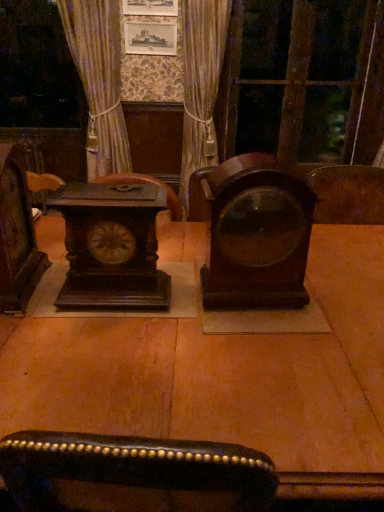
Measure the distance between point (x=83, y=368) and camera.

A: They are 36.22 inches apart.

The image size is (384, 512). Find the location of `dark wood table at center`. dark wood table at center is located at coordinates (220, 371).

I want to click on velvet gold curtain at center, so click(201, 84).

The height and width of the screenshot is (512, 384). In order to click on dark wood table at center in this screenshot , I will do 220,371.

Consider the image. Is mahogany wood alarm clock at center, which is counted as the 1th alarm clock, starting from the right, in front of or behind velvet gold curtain at center in the image?

mahogany wood alarm clock at center, which is counted as the 1th alarm clock, starting from the right, is in front of velvet gold curtain at center.

From a real-world perspective, which object stands above the other?

velvet gold curtain at center, from a real-world perspective.

Is mahogany wood alarm clock at center, the 2th alarm clock positioned from the left, taller than velvet gold curtain at center?

Incorrect, the height of mahogany wood alarm clock at center, the 2th alarm clock positioned from the left, is not larger of that of velvet gold curtain at center.

In the scene shown: From a real-world perspective, which object stands above the other?

From a 3D spatial view, velvet gold curtain at center is above.

From the image's perspective, is velvet gold curtain at center on top of dark brown wood clock at left, the 2th alarm clock in the right-to-left sequence?

Yes, from the image's perspective, velvet gold curtain at center is above dark brown wood clock at left, the 2th alarm clock in the right-to-left sequence.

Is the depth of velvet gold curtain at center greater than that of dark brown wood clock at left, the 2th alarm clock in the right-to-left sequence?

Yes, velvet gold curtain at center is further from the viewer.

Which object is wider, velvet gold curtain at center or dark brown wood clock at left, positioned as the 1th alarm clock in left-to-right order?

velvet gold curtain at center.

Which is more to the left, dark wood clock at left or dark brown wood clock at left, positioned as the 1th alarm clock in left-to-right order?

From the viewer's perspective, dark wood clock at left appears more on the left side.

Is dark wood clock at left looking in the opposite direction of dark brown wood clock at left, positioned as the 1th alarm clock in left-to-right order?

dark wood clock at left does not have its back to dark brown wood clock at left, positioned as the 1th alarm clock in left-to-right order.

From the picture: Is dark wood clock at left located outside dark brown wood clock at left, positioned as the 1th alarm clock in left-to-right order?

Absolutely, dark wood clock at left is external to dark brown wood clock at left, positioned as the 1th alarm clock in left-to-right order.

Is the surface of dark wood clock at left in direct contact with dark brown wood clock at left, the 2th alarm clock in the right-to-left sequence?

No, dark wood clock at left is not beside dark brown wood clock at left, the 2th alarm clock in the right-to-left sequence.

Can you confirm if velvet gold curtain at center is shorter than dark wood clock at left?

Incorrect, the height of velvet gold curtain at center does not fall short of that of dark wood clock at left.

Is velvet gold curtain at center facing towards dark wood clock at left?

No, velvet gold curtain at center is not turned towards dark wood clock at left.

Is there a large distance between velvet gold curtain at center and dark wood clock at left?

velvet gold curtain at center is positioned a significant distance from dark wood clock at left.

Considering the positions of points (206, 91) and (21, 200), is point (206, 91) closer to camera compared to point (21, 200)?

No.

From a real-world perspective, is transparent glass door at upper right located higher than mahogany wood alarm clock at center, the 2th alarm clock positioned from the left?

Correct, in the physical world, transparent glass door at upper right is higher than mahogany wood alarm clock at center, the 2th alarm clock positioned from the left.

Does transparent glass door at upper right have a greater height compared to mahogany wood alarm clock at center, the 2th alarm clock positioned from the left?

Correct, transparent glass door at upper right is much taller as mahogany wood alarm clock at center, the 2th alarm clock positioned from the left.

From a real-world perspective, which alarm clock is the 1st one underneath the transparent glass door at upper right? Please provide its 2D coordinates.

[(254, 232)]

Could you tell me if mahogany wood alarm clock at center, which is counted as the 1th alarm clock, starting from the right, is facing dark brown wood clock at left, the 2th alarm clock in the right-to-left sequence?

No, mahogany wood alarm clock at center, which is counted as the 1th alarm clock, starting from the right, is not aimed at dark brown wood clock at left, the 2th alarm clock in the right-to-left sequence.

Considering the positions of objects mahogany wood alarm clock at center, the 2th alarm clock positioned from the left, and dark brown wood clock at left, positioned as the 1th alarm clock in left-to-right order, in the image provided, who is more to the left, mahogany wood alarm clock at center, the 2th alarm clock positioned from the left, or dark brown wood clock at left, positioned as the 1th alarm clock in left-to-right order,?

From the viewer's perspective, dark brown wood clock at left, positioned as the 1th alarm clock in left-to-right order, appears more on the left side.

Does point (243, 294) come closer to viewer compared to point (87, 304)?

No, (243, 294) is further to viewer.

Consider the image. Between mahogany wood alarm clock at center, the 2th alarm clock positioned from the left, and dark brown wood clock at left, the 2th alarm clock in the right-to-left sequence, which one has smaller size?

dark brown wood clock at left, the 2th alarm clock in the right-to-left sequence, is smaller.

Which of these two, mahogany wood alarm clock at center, which is counted as the 1th alarm clock, starting from the right, or dark wood table at center, is thinner?

mahogany wood alarm clock at center, which is counted as the 1th alarm clock, starting from the right, is thinner.

Considering the relative sizes of mahogany wood alarm clock at center, the 2th alarm clock positioned from the left, and dark wood table at center in the image provided, is mahogany wood alarm clock at center, the 2th alarm clock positioned from the left, taller than dark wood table at center?

In fact, mahogany wood alarm clock at center, the 2th alarm clock positioned from the left, may be shorter than dark wood table at center.

Is dark wood table at center at the back of mahogany wood alarm clock at center, which is counted as the 1th alarm clock, starting from the right?

No, mahogany wood alarm clock at center, which is counted as the 1th alarm clock, starting from the right, is not facing the opposite direction of dark wood table at center.

How distant is mahogany wood alarm clock at center, the 2th alarm clock positioned from the left, from dark wood table at center?

mahogany wood alarm clock at center, the 2th alarm clock positioned from the left, is 26.50 centimeters from dark wood table at center.

This screenshot has width=384, height=512. What are the coordinates of `alarm clock lying on the right of velvet gold curtain at center` in the screenshot? It's located at (254, 232).

This screenshot has width=384, height=512. Find the location of `the 2nd alarm clock below the velvet gold curtain at center (from the image's perspective)`. the 2nd alarm clock below the velvet gold curtain at center (from the image's perspective) is located at coordinates (111, 246).

From the picture: Looking at the image, which one is located further to dark wood clock at left, dark brown wood clock at left, the 2th alarm clock in the right-to-left sequence, or transparent glass door at upper right?

transparent glass door at upper right.

Estimate the real-world distances between objects in this image. Which object is further from velvet gold curtain at center, transparent glass door at upper right or dark brown wood clock at left, positioned as the 1th alarm clock in left-to-right order?

dark brown wood clock at left, positioned as the 1th alarm clock in left-to-right order, is further to velvet gold curtain at center.

Based on their spatial positions, is dark wood table at center or transparent glass door at upper right closer to mahogany wood alarm clock at center, the 2th alarm clock positioned from the left?

dark wood table at center is positioned closer to the anchor mahogany wood alarm clock at center, the 2th alarm clock positioned from the left.

When comparing their distances from velvet gold curtain at center, does dark brown wood clock at left, the 2th alarm clock in the right-to-left sequence, or mahogany wood alarm clock at center, which is counted as the 1th alarm clock, starting from the right, seem closer?

dark brown wood clock at left, the 2th alarm clock in the right-to-left sequence, lies closer to velvet gold curtain at center than the other object.

From the image, which object appears to be farther from dark wood clock at left, velvet gold curtain at center or dark brown wood clock at left, positioned as the 1th alarm clock in left-to-right order?

Among the two, velvet gold curtain at center is located further to dark wood clock at left.

When comparing their distances from transparent glass door at upper right, does mahogany wood alarm clock at center, the 2th alarm clock positioned from the left, or velvet gold curtain at center seem closer?

velvet gold curtain at center is closer to transparent glass door at upper right.

From the image, which object appears to be farther from mahogany wood alarm clock at center, the 2th alarm clock positioned from the left, dark wood clock at left or dark brown wood clock at left, positioned as the 1th alarm clock in left-to-right order?

dark wood clock at left.

From the picture: Based on their spatial positions, is velvet gold curtain at center or dark brown wood clock at left, the 2th alarm clock in the right-to-left sequence, closer to mahogany wood alarm clock at center, the 2th alarm clock positioned from the left?

The object closer to mahogany wood alarm clock at center, the 2th alarm clock positioned from the left, is dark brown wood clock at left, the 2th alarm clock in the right-to-left sequence.

The width and height of the screenshot is (384, 512). I want to click on curtain between mahogany wood alarm clock at center, which is counted as the 1th alarm clock, starting from the right, and transparent glass door at upper right in the front-back direction, so click(x=201, y=84).

Identify the location of curtain located between dark wood clock at left and transparent glass door at upper right in the depth direction. (201, 84).

The height and width of the screenshot is (512, 384). In order to click on table located between dark wood clock at left and mahogany wood alarm clock at center, which is counted as the 1th alarm clock, starting from the right, in the left-right direction in this screenshot , I will do (x=220, y=371).

Where is `curtain between dark brown wood clock at left, positioned as the 1th alarm clock in left-to-right order, and transparent glass door at upper right in the front-back direction`? curtain between dark brown wood clock at left, positioned as the 1th alarm clock in left-to-right order, and transparent glass door at upper right in the front-back direction is located at coordinates (201, 84).